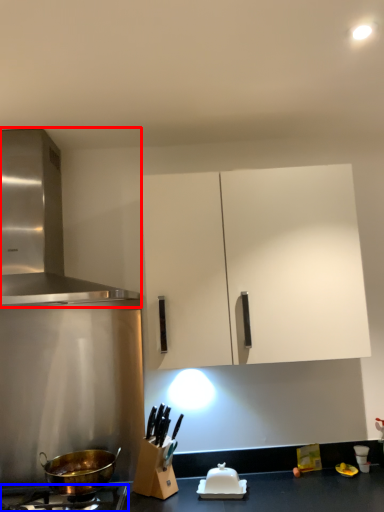
Question: Which object is closer to the camera taking this photo, kitchen appliance (highlighted by a red box) or gas stove (highlighted by a blue box)?

Choices:
 (A) kitchen appliance
 (B) gas stove

Answer: (B)